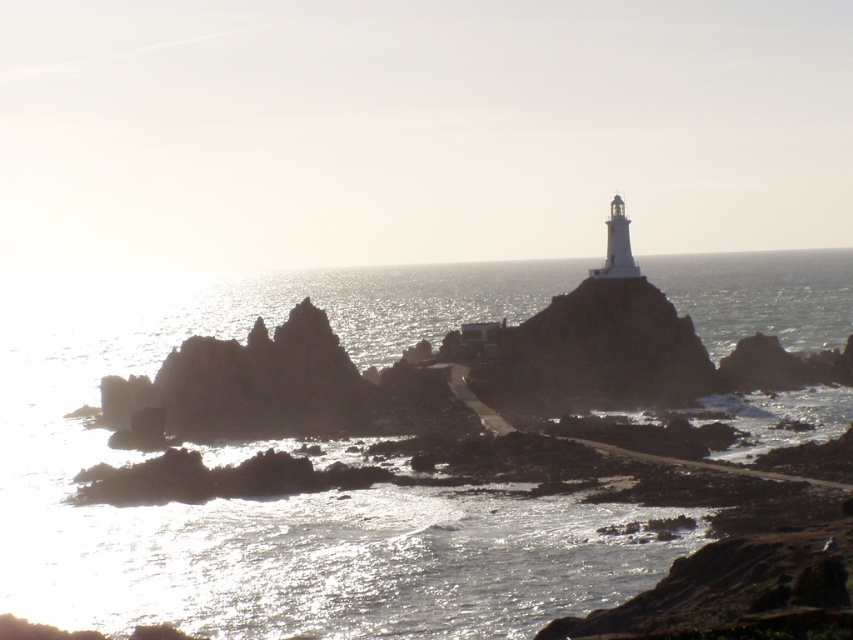
In the scene shown: Does glistening silver water at center have a lesser height compared to dark gray rocky outcrop at center?

No.

Describe the element at coordinates (287, 497) in the screenshot. This screenshot has height=640, width=853. I see `glistening silver water at center` at that location.

The height and width of the screenshot is (640, 853). Identify the location of glistening silver water at center. (287, 497).